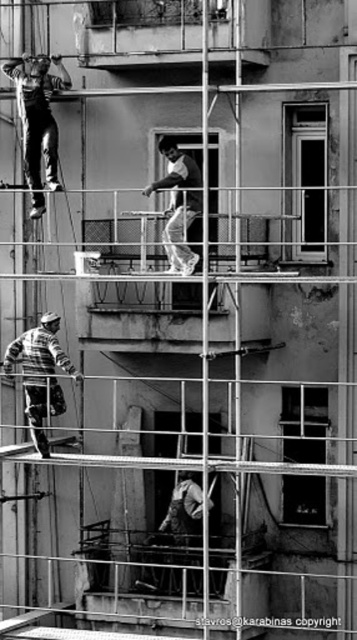
You are a safety inspector assessing the construction site shown in the image. You need to ensure that the shiny black overalls at upper left and the striped sweater at lower left are positioned safely. Based on their heights, which worker is at a higher elevation and thus requires closer monitoring for fall risks?

The shiny black overalls at upper left has a greater height compared to striped sweater at lower left, so the worker in shiny black overalls at upper left is at a higher elevation and requires closer monitoring for fall risks.

You are a safety inspector looking at the construction site. You notice two workers, one wearing shiny black overalls at upper left and another in smooth white shirt at center. Which worker is positioned farther from the front of the scene?

The smooth white shirt at center is behind shiny black overalls at upper left, so the smooth white shirt at center is farther from the front.

You are a construction inspector reviewing this photo. You need to determine which of the two points, point (58, 364) or point (171, 198), is closer to the camera. Based on the image, which point is nearer?

Point (58, 364) is closer to the camera than point (171, 198).